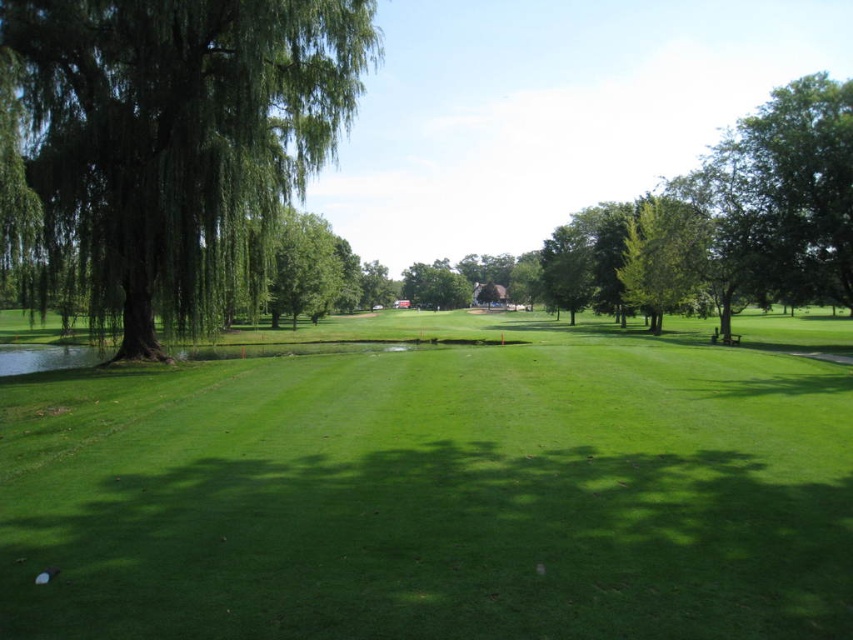
You are standing at the center of the golf course and see two points marked on the fairway. The first point is at coordinate point (312, 563) and the second is at point (701, 256). Which point is closer to your current position?

Point (312, 563) is closer to the viewer than point (701, 256), so the first point is closer to your current position.

Looking at this image, you are standing at the center of the green grassy area in the foreground of the golf course. You see a point marked at coordinates [177,138]. What object does this point indicate?

The point at coordinates [177,138] marks the green leafy tree at left.